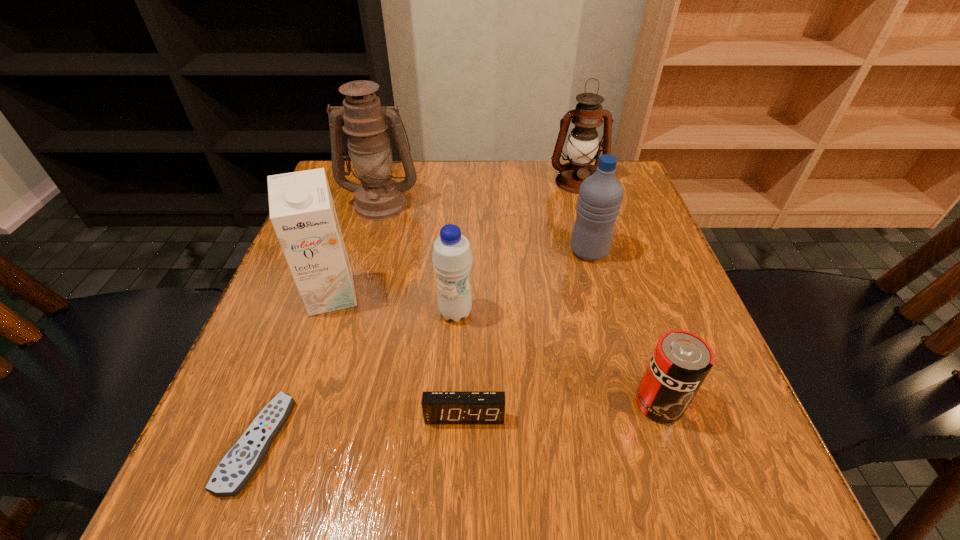
In the image, there is a desktop. What are the coordinates of `vacant space at the near edge` in the screenshot? It's located at (604, 481).

Locate an element on the screen. This screenshot has height=540, width=960. vacant region at the left edge of the desktop is located at coordinates (298, 387).

Where is `free spot at the right edge of the desktop`? free spot at the right edge of the desktop is located at coordinates (657, 247).

Where is `free space between the left water bottle and the alarm clock`? This screenshot has width=960, height=540. free space between the left water bottle and the alarm clock is located at coordinates (460, 364).

Where is `blank region between the lantern and the alarm clock`? blank region between the lantern and the alarm clock is located at coordinates (520, 299).

Identify the location of free spot between the second shortest object and the carton. The width and height of the screenshot is (960, 540). tap(398, 355).

The height and width of the screenshot is (540, 960). I want to click on empty location between the nearer water bottle and the second shortest object, so click(460, 364).

Where is `vacant space that is in between the left water bottle and the right water bottle`? This screenshot has height=540, width=960. vacant space that is in between the left water bottle and the right water bottle is located at coordinates (522, 282).

Where is `empty location between the alarm clock and the remote control`? empty location between the alarm clock and the remote control is located at coordinates (361, 429).

At what (x,y) coordinates should I click in order to perform the action: click on vacant region between the nearer water bottle and the lantern. Please return your answer as a coordinate pair (x, y). Looking at the image, I should click on (516, 247).